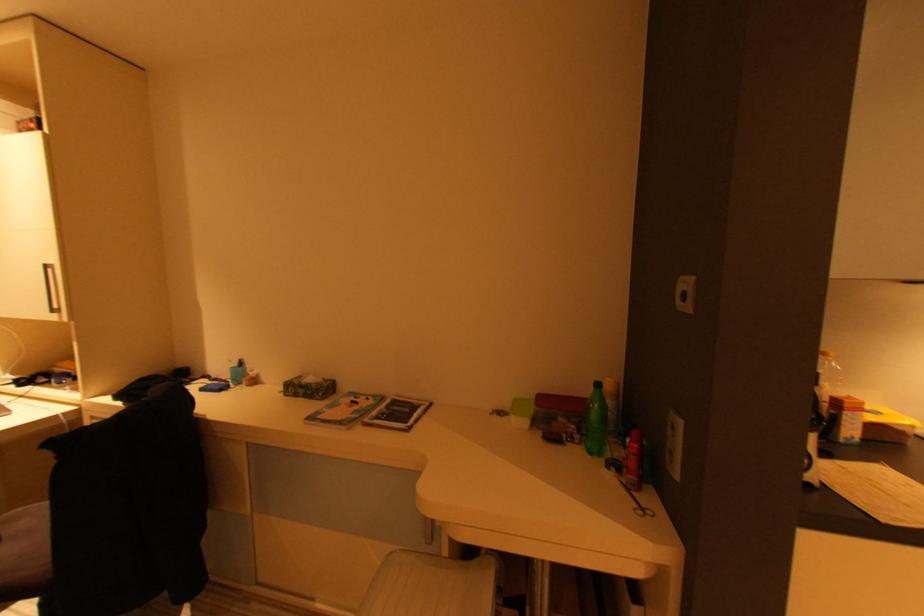
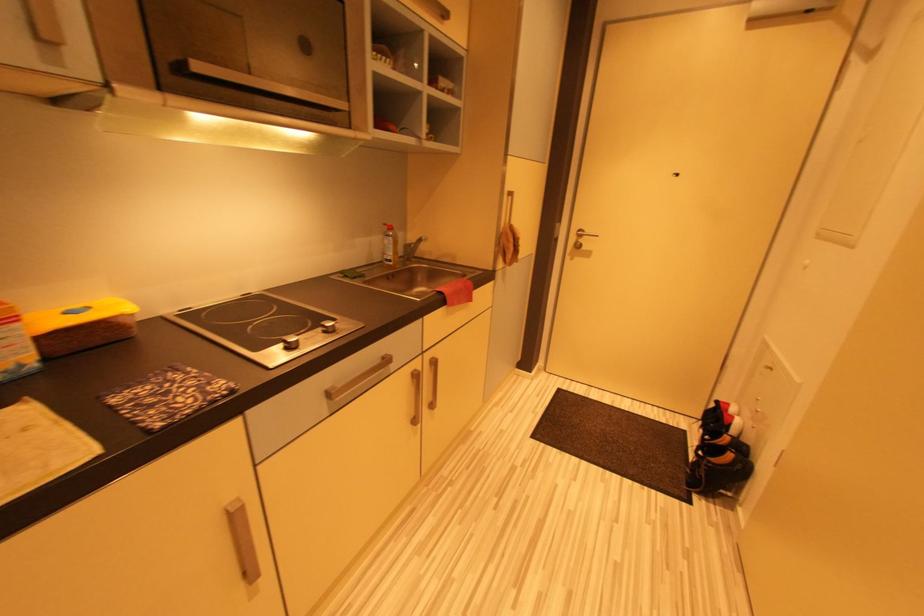
How did the camera likely rotate?

The rotation direction of the camera is right-down.